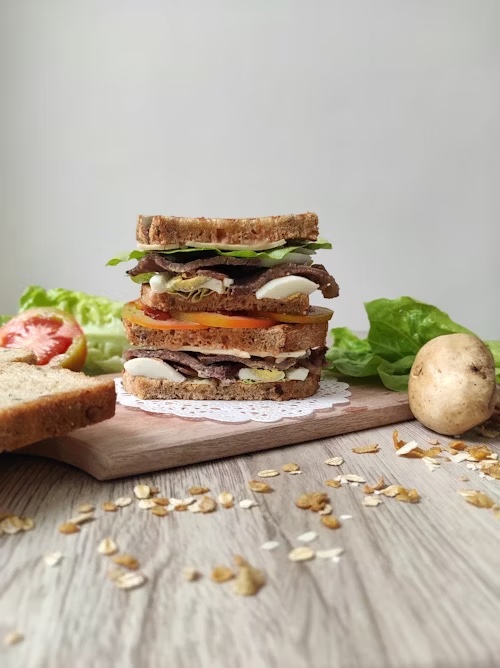
Find the location of a particular element. This screenshot has width=500, height=668. cutting board is located at coordinates pos(152,433).